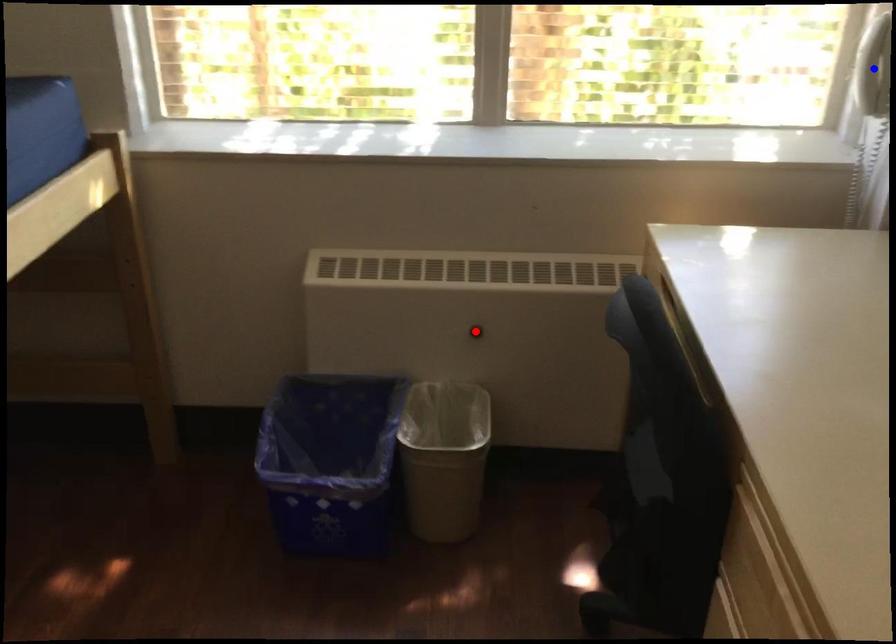
Question: Which of the two points in the image is closer to the camera?

Choices:
 (A) Blue point is closer.
 (B) Red point is closer.

Answer: (A)